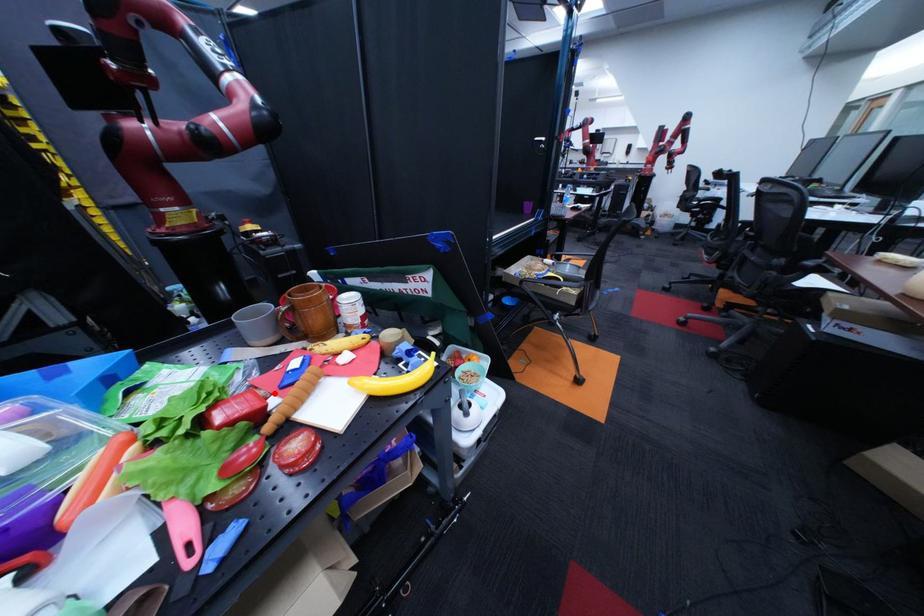
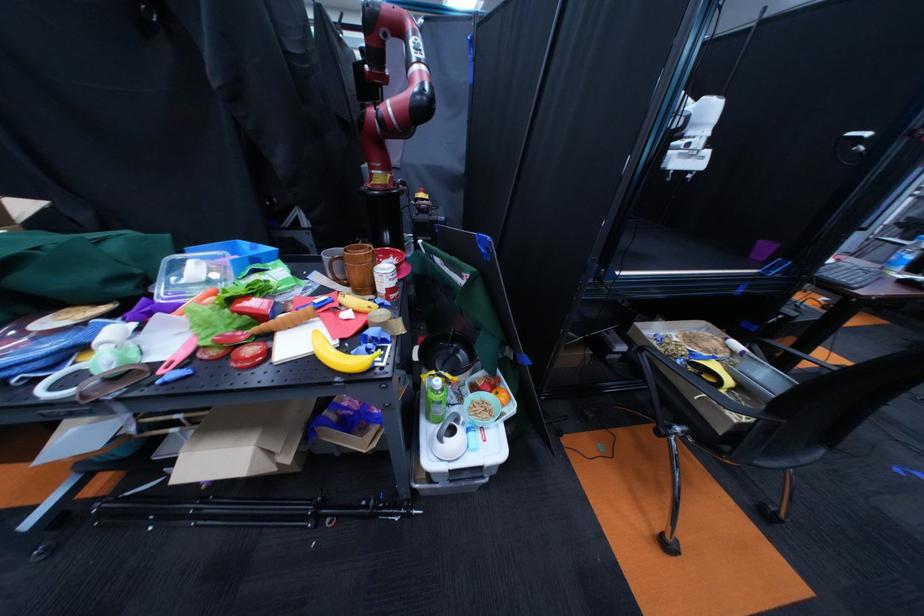
Locate, in the second image, the point that corresponds to the highlighted location in the first image.

(305, 307)